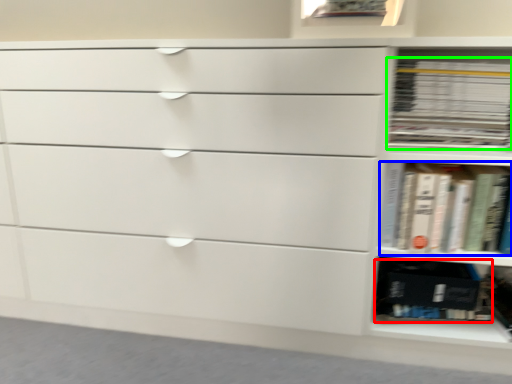
Question: Based on their relative distances, which object is farther from paperback book (highlighted by a red box)? Choose from book (highlighted by a blue box) and book (highlighted by a green box).

Choices:
 (A) book
 (B) book

Answer: (B)